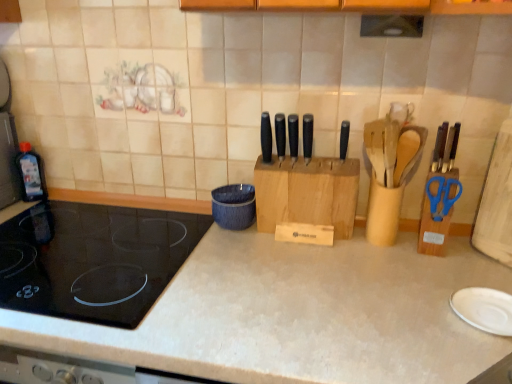
Image resolution: width=512 pixels, height=384 pixels. What are the coordinates of `free space behind black matte knife at center, which appears as the second knife when viewed from the right` in the screenshot? It's located at (310, 155).